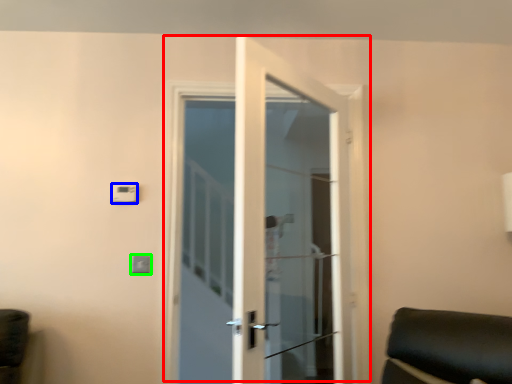
Question: Estimate the real-world distances between objects in this image. Which object is farther from door (highlighted by a red box), light switch (highlighted by a blue box) or light switch (highlighted by a green box)?

Choices:
 (A) light switch
 (B) light switch

Answer: (A)